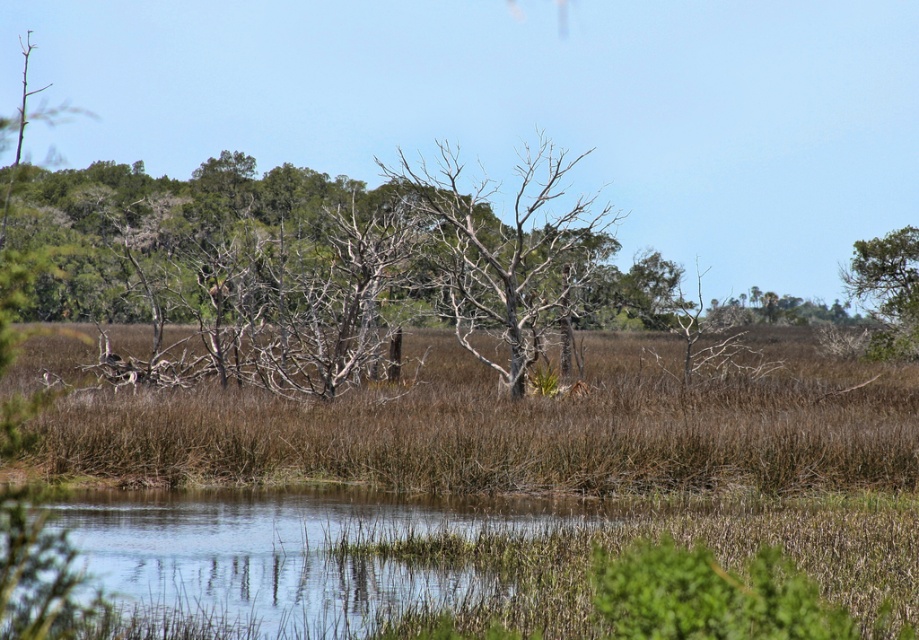
Question: Which point is farther from the camera taking this photo?

Choices:
 (A) (915, 305)
 (B) (570, 244)

Answer: (A)

Question: Is bare wood tree at center smaller than green leafy tree at upper right?

Choices:
 (A) yes
 (B) no

Answer: (B)

Question: From the image, what is the correct spatial relationship of bare wood tree at center in relation to green leafy tree at upper right?

Choices:
 (A) below
 (B) above

Answer: (B)

Question: Which object appears farthest from the camera in this image?

Choices:
 (A) green leafy tree at upper right
 (B) bare wood tree at center

Answer: (A)

Question: In this image, where is bare wood tree at center located relative to green leafy tree at upper right?

Choices:
 (A) below
 (B) above

Answer: (B)